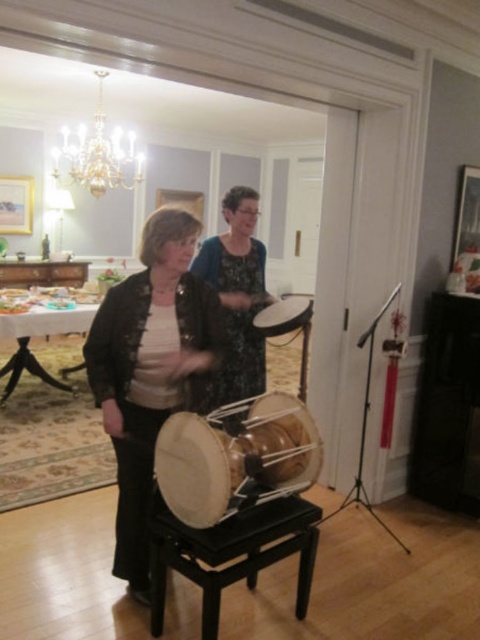
You are standing at the entrance of the room and see the point at coordinates [230,554]. Which object is this point located on?

The point at coordinates [230,554] is located on the black wood stool at center.

Looking at this image, you are standing at the entrance of the room and want to greet the person wearing the dark floral dress at center. According to the coordinates provided, in which direction should you move to reach them?

The dark floral dress at center is located at coordinates point 0.494, so you should move forward towards the center of the room to reach them.